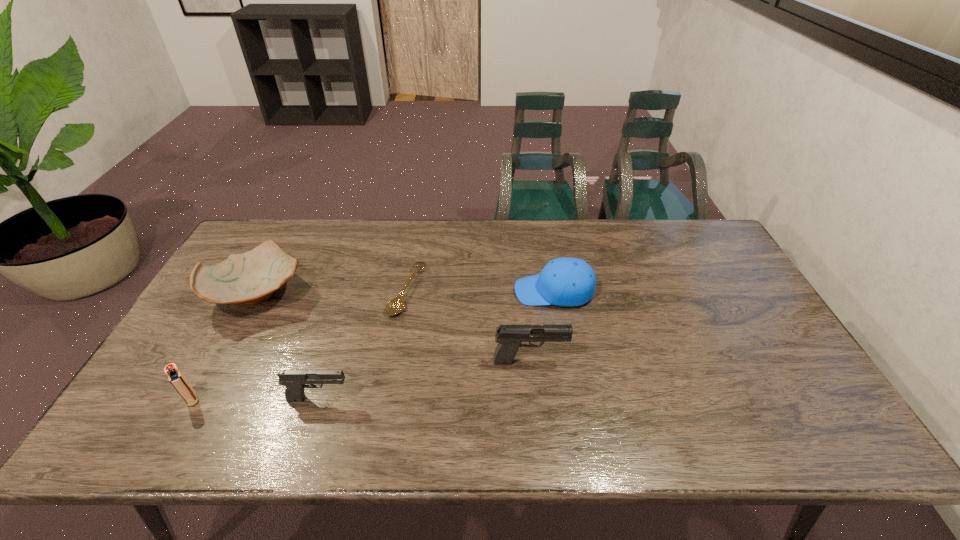
Find the location of `igniter located in the left edge section of the desktop`. igniter located in the left edge section of the desktop is located at coordinates (176, 378).

This screenshot has height=540, width=960. Find the location of `object present at the near left corner`. object present at the near left corner is located at coordinates (176, 378).

Where is `blank space at the far edge of the desktop`? This screenshot has width=960, height=540. blank space at the far edge of the desktop is located at coordinates (335, 238).

Image resolution: width=960 pixels, height=540 pixels. I want to click on free location at the near edge, so tap(405, 380).

Image resolution: width=960 pixels, height=540 pixels. Identify the location of vacant space at the left edge of the desktop. (219, 317).

I want to click on vacant space at the far left corner, so click(x=246, y=244).

Find the location of a particular element. vacant space at the far right corner of the desktop is located at coordinates (680, 258).

The width and height of the screenshot is (960, 540). In order to click on vacant space at the near right corner of the desktop in this screenshot , I will do `click(810, 391)`.

Find the location of `vacant point located between the third object from right to left and the igniter`. vacant point located between the third object from right to left and the igniter is located at coordinates (300, 345).

Find the location of a particular element. This screenshot has width=960, height=540. free space between the cap and the shorter pistol is located at coordinates (437, 345).